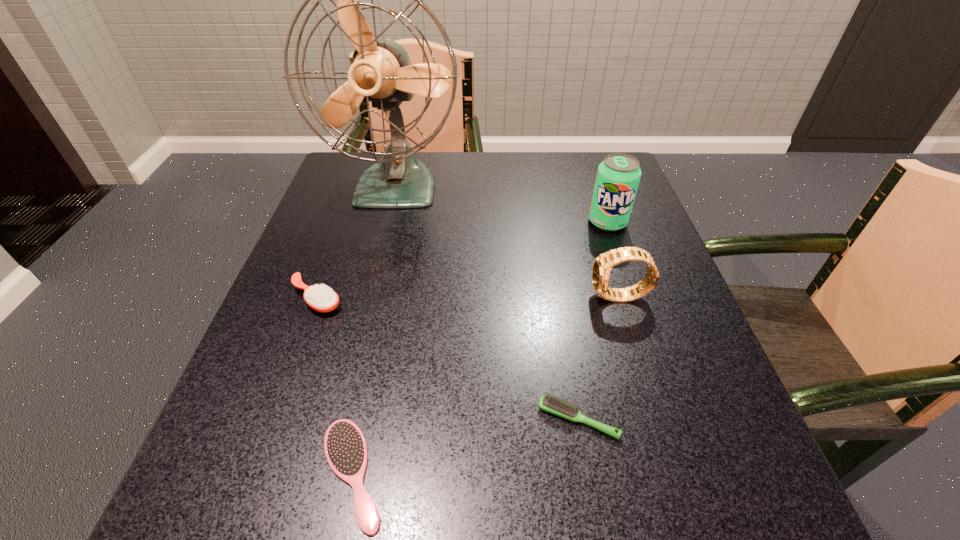
You are a GUI agent. You are given a task and a screenshot of the screen. Output one action in this format:
    pyautogui.click(x=<x>, y=<y>)
    Task: Click on the free spot located on the face of the watch
    
    Given the screenshot: What is the action you would take?
    pyautogui.click(x=564, y=298)

Image resolution: width=960 pixels, height=540 pixels. I want to click on vacant region located 0.100m on the face of the watch, so click(x=538, y=298).

The height and width of the screenshot is (540, 960). I want to click on free region located on the right of the fourth tallest object, so pos(531,298).

You are a GUI agent. You are given a task and a screenshot of the screen. Output one action in this format:
    pyautogui.click(x=<x>, y=<y>)
    Task: Click on the vacant space located 0.400m on the left of the third object from right to left
    The width and height of the screenshot is (960, 540).
    Given the screenshot: What is the action you would take?
    pyautogui.click(x=269, y=419)

The image size is (960, 540). Identify the location of vacant area situated on the back of the second hairbrush from right to left. (390, 290).

You are a GUI agent. You are given a task and a screenshot of the screen. Output one action in this format:
    pyautogui.click(x=<x>, y=<y>)
    Task: Click on the object present at the far edge
    
    Given the screenshot: What is the action you would take?
    pyautogui.click(x=381, y=71)

I want to click on object at the near edge, so 345,447.

This screenshot has height=540, width=960. In order to click on fan situated at the left edge in this screenshot , I will do `click(381, 71)`.

Find the location of a particular element. The image size is (960, 540). pop soda at the right edge is located at coordinates (618, 176).

Identify the location of watch that is at the right edge. This screenshot has height=540, width=960. (602, 265).